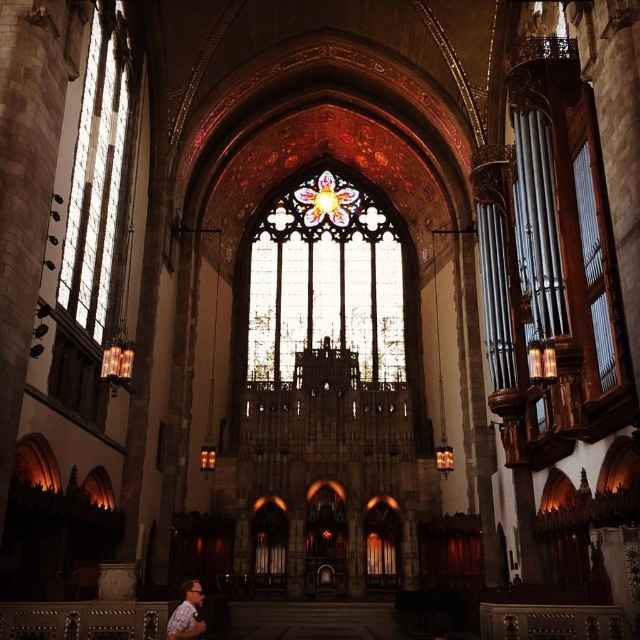
Who is more forward, [93,323] or [196,609]?

Point [196,609] is in front.

Who is more distant from viewer, (83, 276) or (198, 588)?

The point (83, 276) is more distant.

Locate an element on the screen. This screenshot has width=640, height=640. clear glass window at left is located at coordinates (97, 179).

Does stained glass at center have a lesser height compared to clear glass window at left?

Indeed, stained glass at center has a lesser height compared to clear glass window at left.

This screenshot has width=640, height=640. I want to click on stained glass at center, so click(324, 289).

Identify the location of stained glass at center. (324, 289).

Who is more forward, [328,221] or [198,634]?

Point [198,634]

Between stained glass at center and printed cotton shirt at lower left, which one has less height?

Standing shorter between the two is printed cotton shirt at lower left.

Between point (248, 381) and point (186, 611), which one is positioned in front?

Point (186, 611)

This screenshot has height=640, width=640. I want to click on stained glass at center, so click(324, 289).